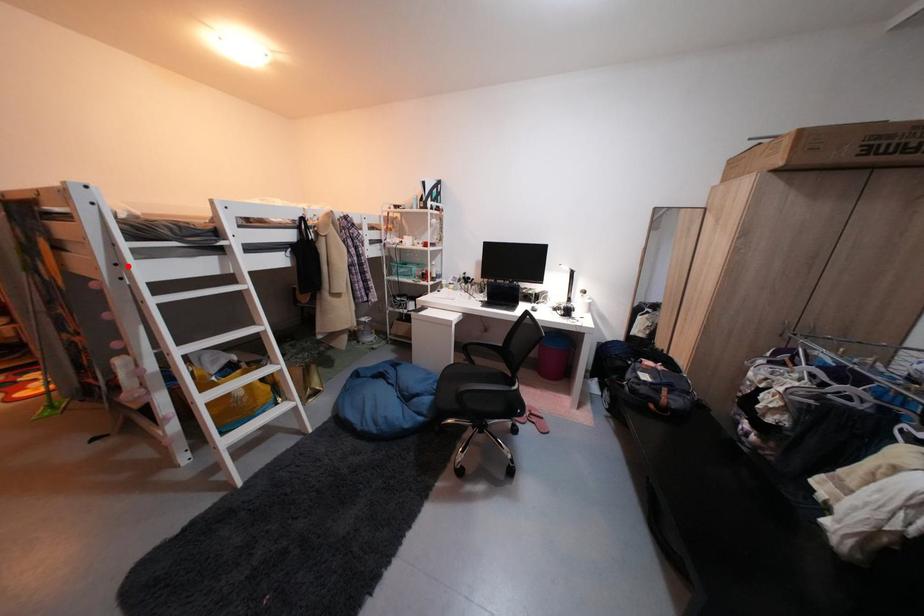
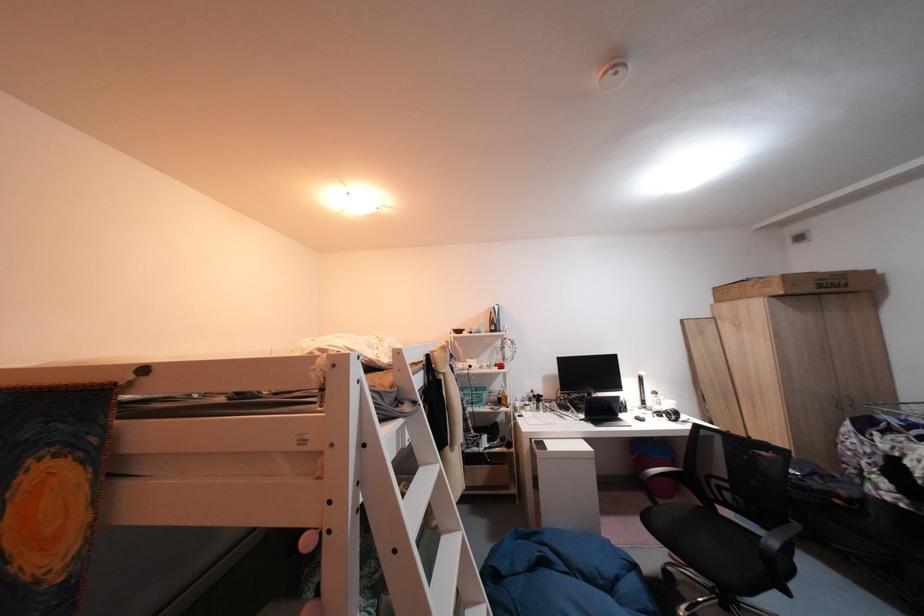
Where in the second image is the point corresponding to the highlighted location from the first image?

(370, 485)